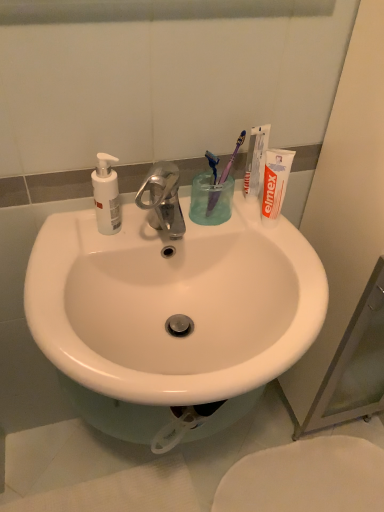
What are the coordinates of `vacant space situated on the left part of purple plastic toothbrush at upper center, which appears as the first toothbrush when viewed from the left` in the screenshot? It's located at (125, 226).